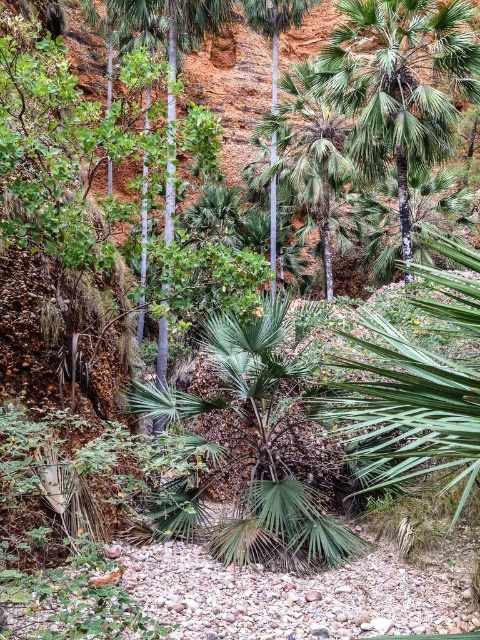
Question: Which object appears farthest from the camera in this image?

Choices:
 (A) green leafy palm tree at center
 (B) green leafy palm tree at upper center

Answer: (B)

Question: Does green leafy palm tree at upper center have a smaller size compared to green leafy palm tree at center?

Choices:
 (A) no
 (B) yes

Answer: (B)

Question: Can you confirm if green leafy palm tree at upper center is bigger than green leafy palm tree at center?

Choices:
 (A) yes
 (B) no

Answer: (B)

Question: Among these objects, which one is farthest from the camera?

Choices:
 (A) green leafy palm tree at center
 (B) green leafy palm tree at upper center

Answer: (B)

Question: Where is green leafy palm tree at upper center located in relation to green leafy palm tree at center in the image?

Choices:
 (A) above
 (B) below

Answer: (B)